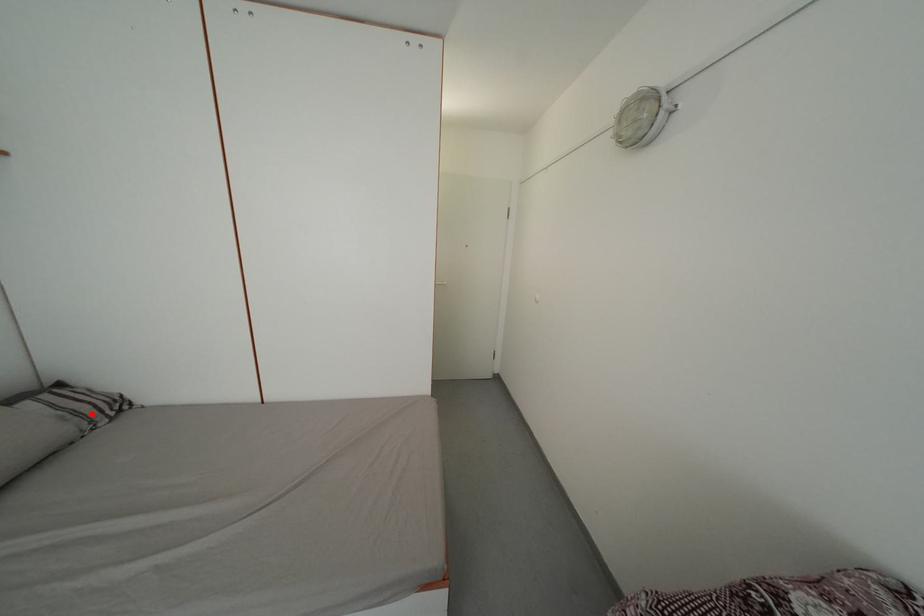
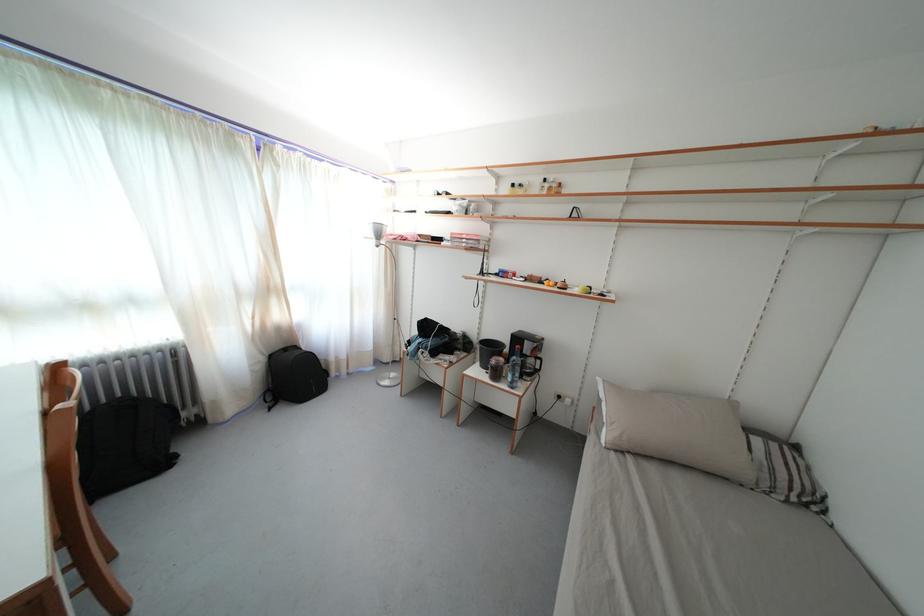
Locate, in the second image, the point that corresponds to the highlighted location in the first image.

(788, 482)